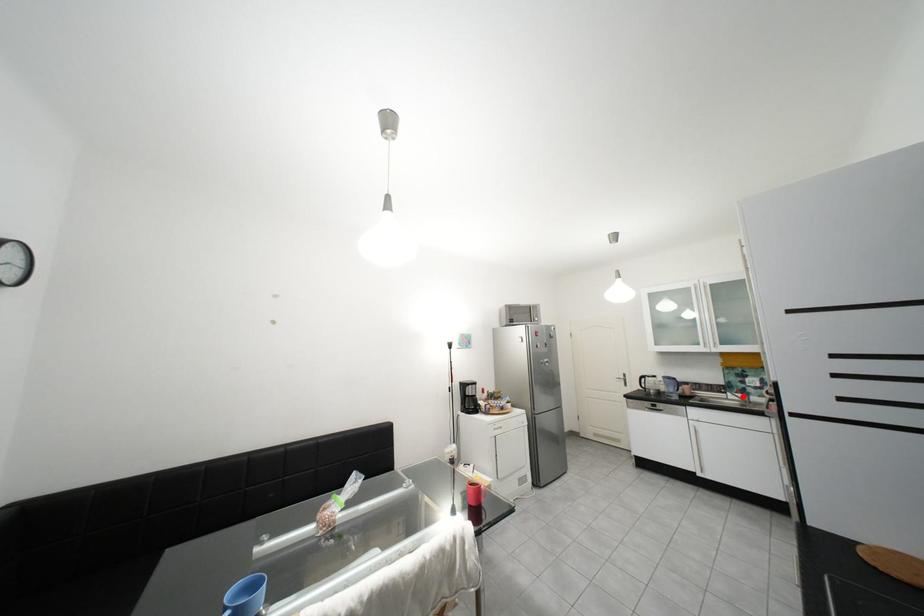
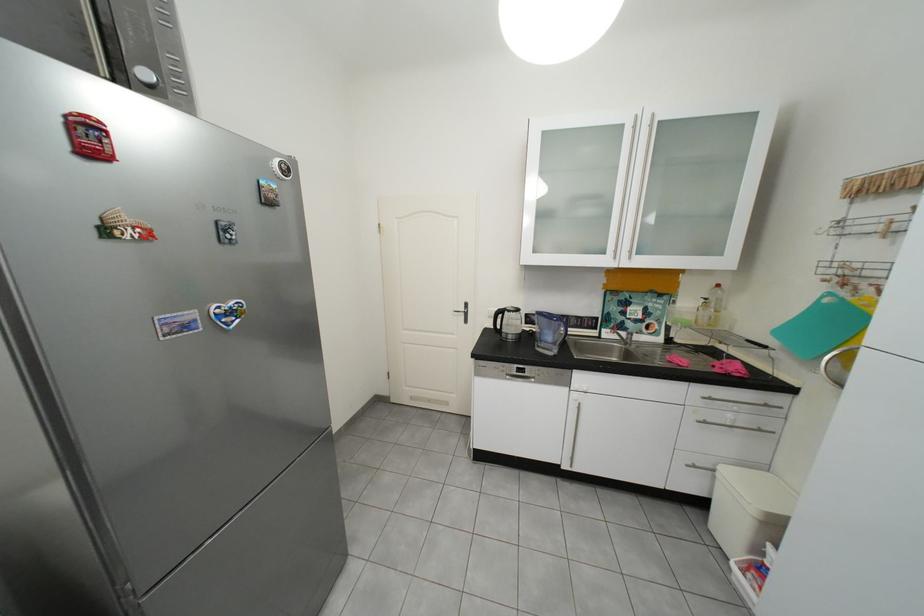
Find the pixel in the second image that matches the highlighted location in the first image.

(619, 334)